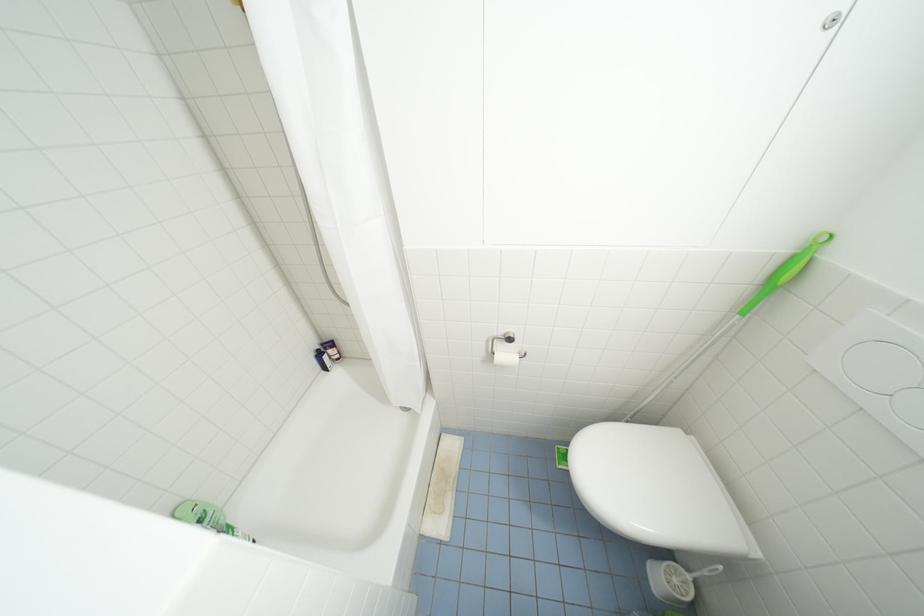
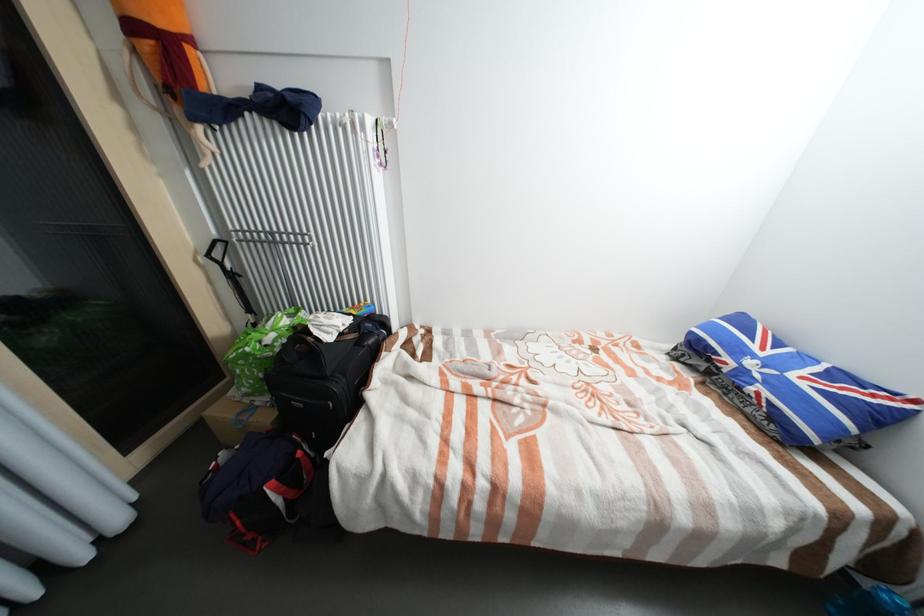
Question: The images are taken continuously from a first-person perspective. In which direction are you moving?

Choices:
 (A) Left
 (B) Right
 (C) Forward
 (D) Backward

Answer: (A)